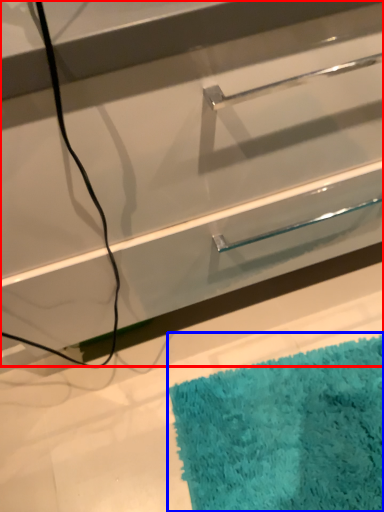
Question: Which of the following is the closest to the observer, drawer (highlighted by a red box) or bath mat (highlighted by a blue box)?

Choices:
 (A) drawer
 (B) bath mat

Answer: (A)